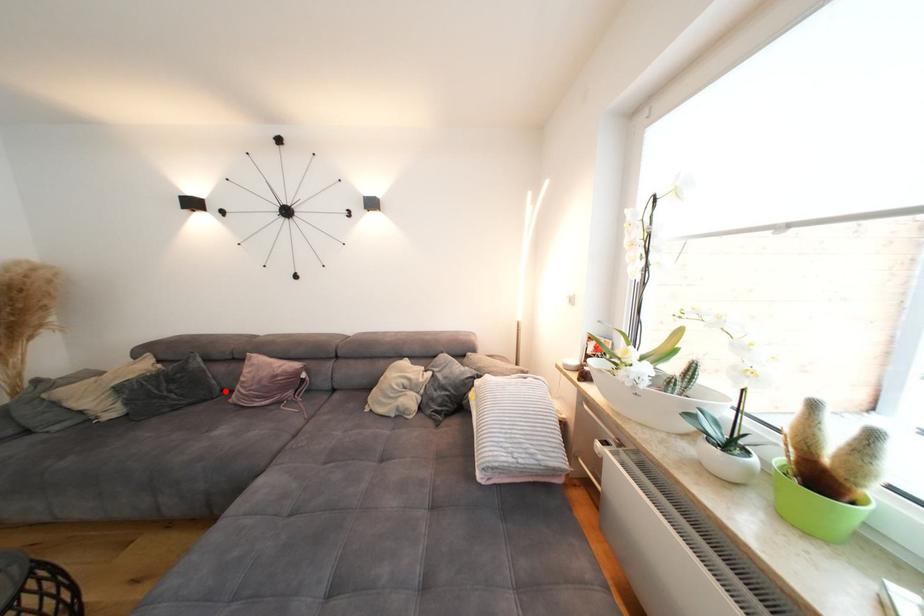
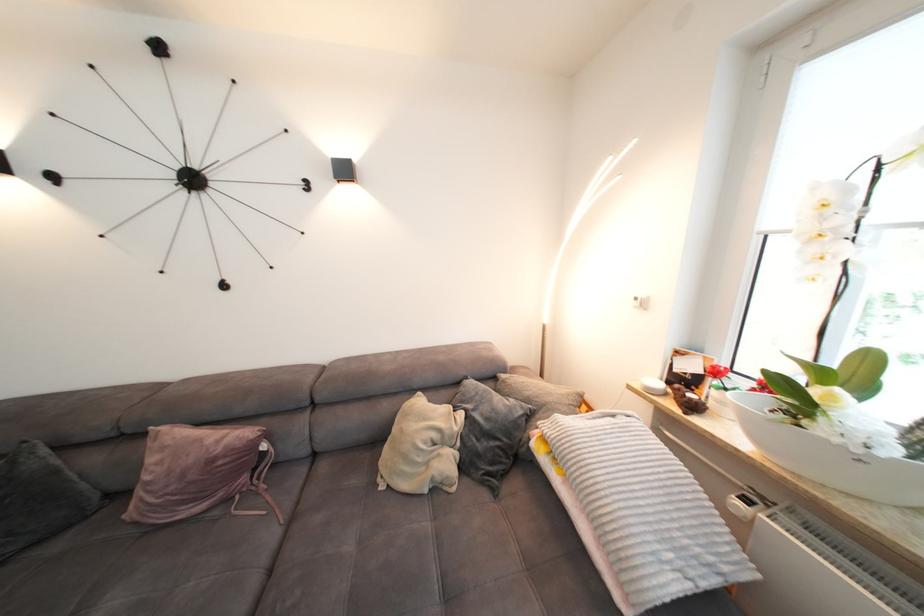
Question: A red point is marked in image1. In image2, is the corresponding 3D point closer to the camera or farther? Reply with the corresponding letter.

Choices:
 (A) The corresponding 3D point is closer.
 (B) The corresponding 3D point is farther.

Answer: (A)